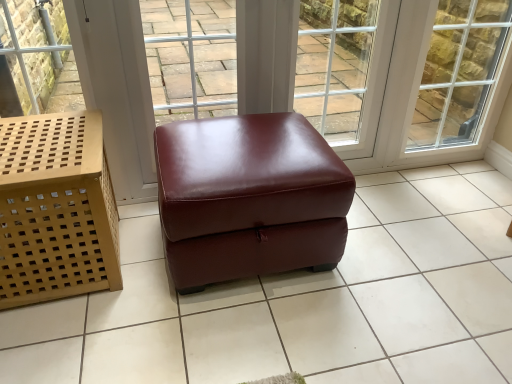
Question: Is light brown woven basket at left in front of glossy leather ottoman at center?

Choices:
 (A) yes
 (B) no

Answer: (B)

Question: Does light brown woven basket at left have a larger size compared to glossy leather ottoman at center?

Choices:
 (A) yes
 (B) no

Answer: (B)

Question: Can you confirm if light brown woven basket at left is taller than glossy leather ottoman at center?

Choices:
 (A) yes
 (B) no

Answer: (A)

Question: Is light brown woven basket at left positioned with its back to glossy leather ottoman at center?

Choices:
 (A) yes
 (B) no

Answer: (B)

Question: Considering the relative sizes of light brown woven basket at left and glossy leather ottoman at center in the image provided, is light brown woven basket at left thinner than glossy leather ottoman at center?

Choices:
 (A) no
 (B) yes

Answer: (B)

Question: Can you confirm if light brown woven basket at left is positioned to the left of glossy leather ottoman at center?

Choices:
 (A) yes
 (B) no

Answer: (A)

Question: Can you confirm if glossy leather ottoman at center is positioned to the left of light brown woven basket at left?

Choices:
 (A) no
 (B) yes

Answer: (A)

Question: From a real-world perspective, is glossy leather ottoman at center physically below light brown woven basket at left?

Choices:
 (A) no
 (B) yes

Answer: (B)

Question: Is glossy leather ottoman at center not within light brown woven basket at left?

Choices:
 (A) no
 (B) yes

Answer: (B)

Question: Does glossy leather ottoman at center contain light brown woven basket at left?

Choices:
 (A) yes
 (B) no

Answer: (B)

Question: Can you confirm if glossy leather ottoman at center is taller than light brown woven basket at left?

Choices:
 (A) no
 (B) yes

Answer: (A)

Question: Is glossy leather ottoman at center oriented away from light brown woven basket at left?

Choices:
 (A) no
 (B) yes

Answer: (A)

Question: From the image's perspective, does clear glass window at upper right appear lower than light brown woven basket at left?

Choices:
 (A) no
 (B) yes

Answer: (A)